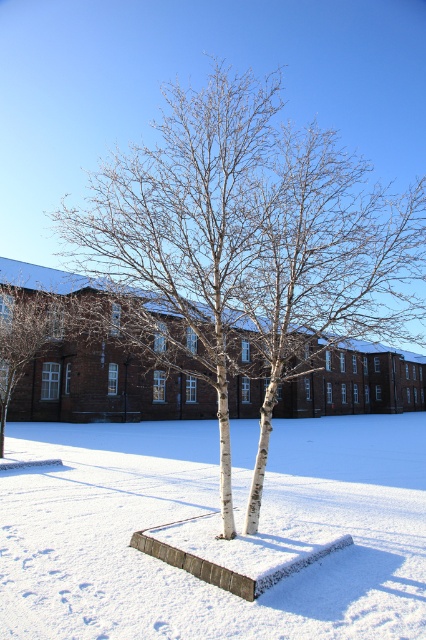
Question: Is white bark tree at center below white powdery snow at center?

Choices:
 (A) yes
 (B) no

Answer: (B)

Question: Which point is farther from the camera taking this photo?

Choices:
 (A) (236, 163)
 (B) (331, 564)

Answer: (A)

Question: Which point is closer to the camera?

Choices:
 (A) white powdery snow at center
 (B) white bark tree at center

Answer: (A)

Question: Does white bark tree at center appear over white powdery snow at center?

Choices:
 (A) yes
 (B) no

Answer: (A)

Question: Does white bark tree at center have a larger size compared to white powdery snow at center?

Choices:
 (A) yes
 (B) no

Answer: (A)